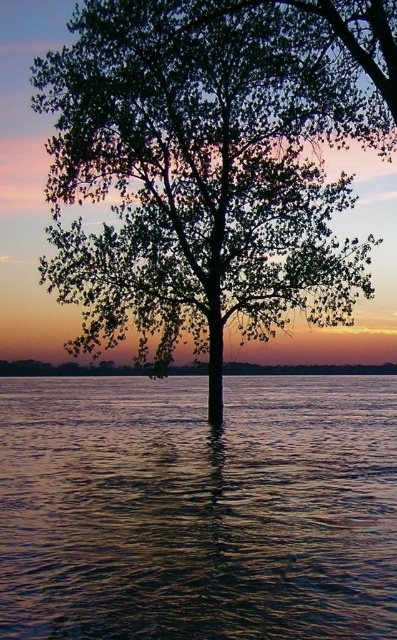
You are standing at the edge of the water and see the green leafy tree at center and the translucent water at center. Which object is positioned to the right side?

The green leafy tree at center is positioned to the right of the translucent water at center.

You are a photographer planning to capture the sunset scene. You want to ensure both the green leafy tree at center and the translucent water at center are visible in your shot. Given that your camera frame can only accommodate objects of a certain width, which object should you prioritize to fit within the frame first?

The green leafy tree at center is narrower than the translucent water at center, so you should prioritize fitting the green leafy tree at center first as it requires less width in the frame.